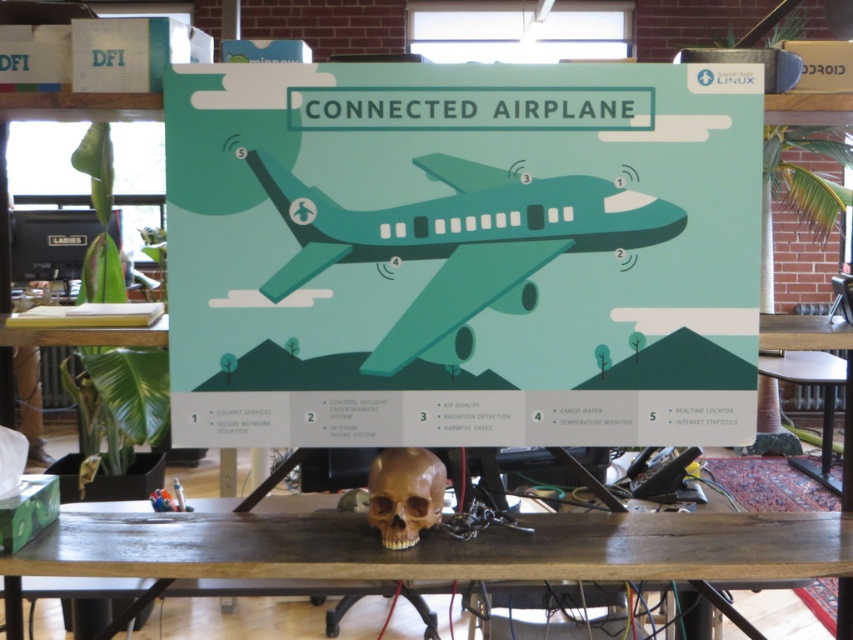
Question: Which of the following is the closest to the observer?

Choices:
 (A) (428, 499)
 (B) (677, 209)

Answer: (B)

Question: Is teal paper airplane at center behind brown wood table at center?

Choices:
 (A) yes
 (B) no

Answer: (A)

Question: Among these points, which one is farthest from the camera?

Choices:
 (A) (397, 529)
 (B) (376, 352)
 (C) (734, 353)

Answer: (C)

Question: Is teal glossy airplane at center below brown matte skull at center?

Choices:
 (A) yes
 (B) no

Answer: (B)

Question: Estimate the real-world distances between objects in this image. Which object is closer to the teal paper airplane at center?

Choices:
 (A) brown wood table at center
 (B) teal glossy airplane at center
 (C) brown matte skull at center

Answer: (B)

Question: Does brown wood table at center appear on the left side of brown matte skull at center?

Choices:
 (A) no
 (B) yes

Answer: (A)